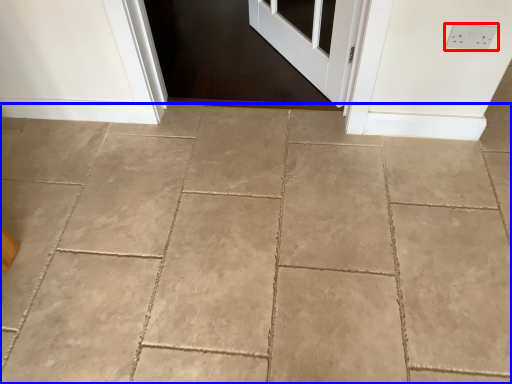
Question: Among these objects, which one is farthest to the camera, electric outlet (highlighted by a red box) or concrete (highlighted by a blue box)?

Choices:
 (A) electric outlet
 (B) concrete

Answer: (A)